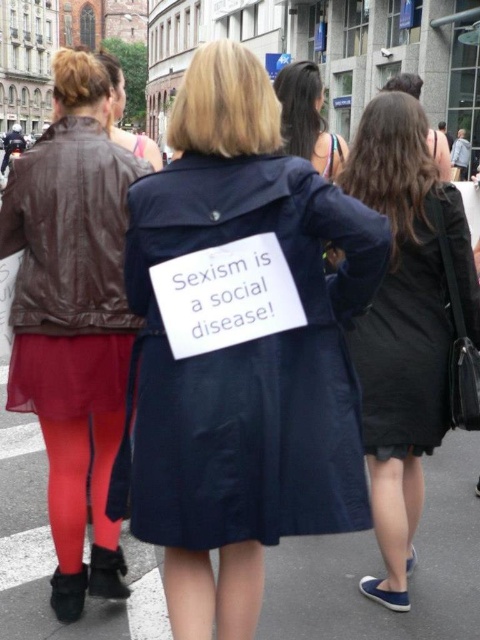
Can you confirm if leather jacket at left is thinner than leather jacket at upper left?

Indeed, leather jacket at left has a lesser width compared to leather jacket at upper left.

The image size is (480, 640). What do you see at coordinates (73, 317) in the screenshot? I see `leather jacket at left` at bounding box center [73, 317].

Identify the location of leather jacket at left. (73, 317).

Can you confirm if dark brown hair at upper center is positioned above leather jacket at upper left?

Incorrect, dark brown hair at upper center is not positioned above leather jacket at upper left.

Does point (327, 145) come behind point (118, 81)?

Yes, it is.

What do you see at coordinates (308, 118) in the screenshot?
I see `dark brown hair at upper center` at bounding box center [308, 118].

Locate an element on the screen. dark brown hair at upper center is located at coordinates (308, 118).

Who is positioned more to the right, navy blue coat at center or leather jacket at upper left?

From the viewer's perspective, navy blue coat at center appears more on the right side.

Between navy blue coat at center and leather jacket at upper left, which one has more height?

Standing taller between the two is leather jacket at upper left.

Where is `navy blue coat at center`? navy blue coat at center is located at coordinates (240, 348).

At what (x,y) coordinates should I click in order to perform the action: click on navy blue coat at center. Please return your answer as a coordinate pair (x, y). Looking at the image, I should click on (240, 348).